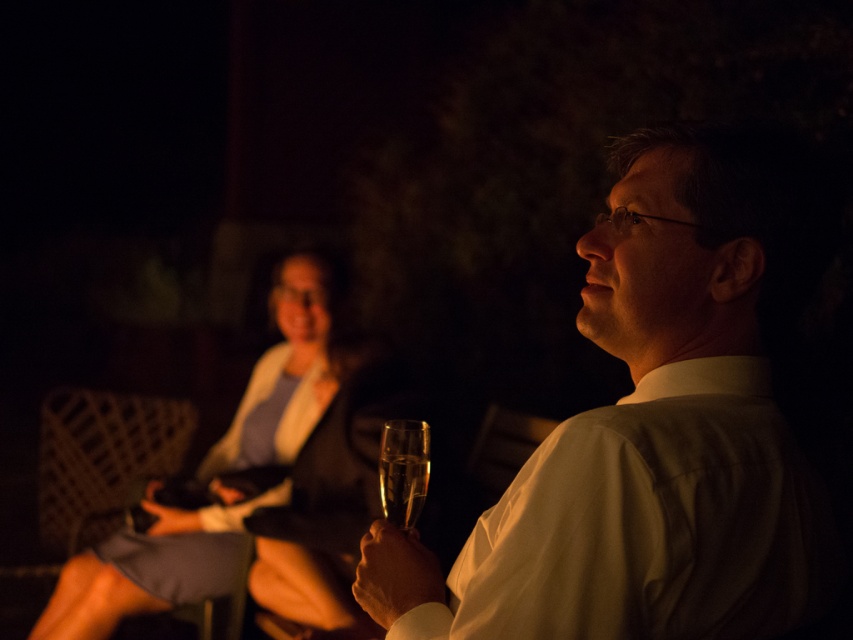
Question: Which point is closer to the camera?

Choices:
 (A) (387, 444)
 (B) (282, 285)
 (C) (724, 620)

Answer: (C)

Question: Is matte white shirt at center above clear glass wine glass at center?

Choices:
 (A) no
 (B) yes

Answer: (B)

Question: Can you confirm if matte white shirt at center is wider than clear glass wine glass at center?

Choices:
 (A) yes
 (B) no

Answer: (A)

Question: Which object is farther from the camera taking this photo?

Choices:
 (A) clear glass wine glass at center
 (B) matte white shirt at center
 (C) matte black dress at center

Answer: (C)

Question: Among these objects, which one is nearest to the camera?

Choices:
 (A) matte white shirt at center
 (B) clear glass wine glass at center

Answer: (A)

Question: Is matte white shirt at center smaller than clear glass wine glass at center?

Choices:
 (A) yes
 (B) no

Answer: (B)